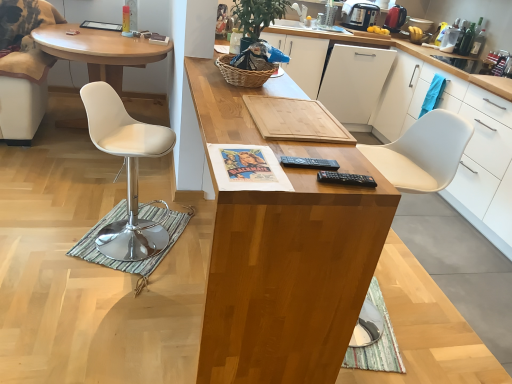
Identify the location of vacant space that is to the left of black plastic remote control at center, marked as the 2th remote control in a bottom-to-top arrangement. (256, 158).